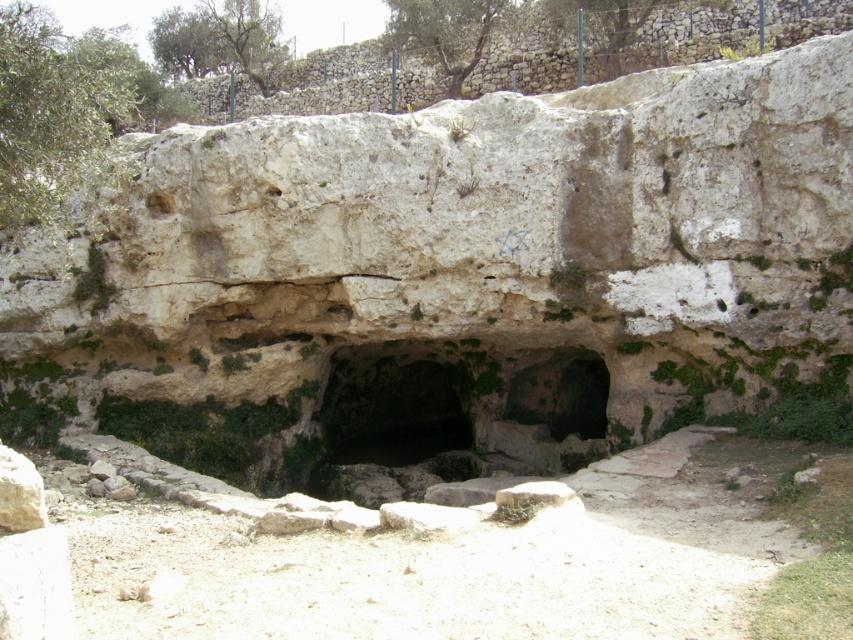
Between green mossy rock at center and smooth stone hole at upper left, which one has less height?

green mossy rock at center

Does point (309, 477) lie in front of point (163, 202)?

No, (309, 477) is further to viewer.

Who is more forward, (561, 368) or (146, 200)?

Point (146, 200) is in front.

You are a GUI agent. You are given a task and a screenshot of the screen. Output one action in this format:
    pyautogui.click(x=<x>, y=<y>)
    Task: Click on the green mossy rock at center
    
    Given the screenshot: What is the action you would take?
    pyautogui.click(x=453, y=419)